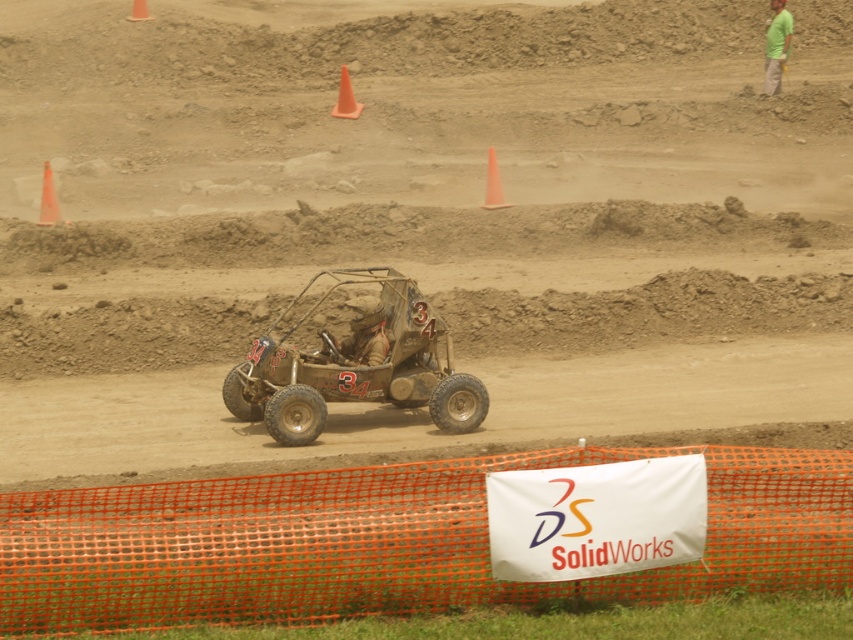
Between point (778, 44) and point (48, 192), which one is positioned behind?

Positioned behind is point (778, 44).

Can you confirm if green cotton shirt at upper right is thinner than orange plastic cone at left?

No, green cotton shirt at upper right is not thinner than orange plastic cone at left.

Find the location of a particular element. green cotton shirt at upper right is located at coordinates (776, 45).

Identify the location of green cotton shirt at upper right. This screenshot has width=853, height=640. (776, 45).

This screenshot has width=853, height=640. Describe the element at coordinates (386, 541) in the screenshot. I see `orange mesh fence at lower center` at that location.

Can you confirm if orange mesh fence at lower center is wider than green cotton shirt at upper right?

Correct, the width of orange mesh fence at lower center exceeds that of green cotton shirt at upper right.

Which is behind, point (281, 564) or point (770, 67)?

Point (770, 67)

Locate an element on the screen. Image resolution: width=853 pixels, height=640 pixels. orange mesh fence at lower center is located at coordinates (386, 541).

Which is behind, point (361, 392) or point (491, 172)?

The point (491, 172) is more distant.

Who is taller, rusty metal buggy at center or orange plastic cone at center?

rusty metal buggy at center

Is point (300, 422) positioned behind point (498, 196)?

No, (300, 422) is in front of (498, 196).

You are a GUI agent. You are given a task and a screenshot of the screen. Output one action in this format:
    pyautogui.click(x=<x>, y=<y>)
    Task: Click on the rusty metal buggy at center
    
    Given the screenshot: What is the action you would take?
    pyautogui.click(x=357, y=365)